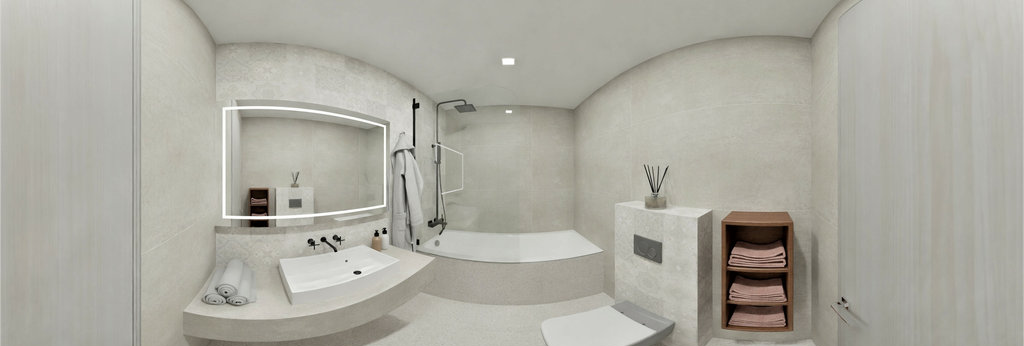
You are a GUI agent. You are given a task and a screenshot of the screen. Output one action in this format:
    pyautogui.click(x=<x>, y=<y>)
    Task: Click on the handles
    
    Given the screenshot: What is the action you would take?
    pyautogui.click(x=303, y=245), pyautogui.click(x=338, y=237), pyautogui.click(x=441, y=221)